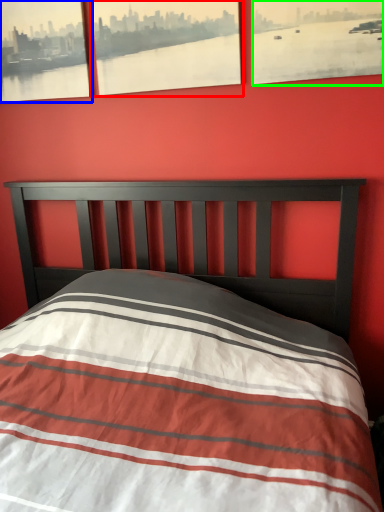
Question: Which is farther away from picture frame (highlighted by a red box)? picture frame (highlighted by a blue box) or picture frame (highlighted by a green box)?

Choices:
 (A) picture frame
 (B) picture frame

Answer: (B)